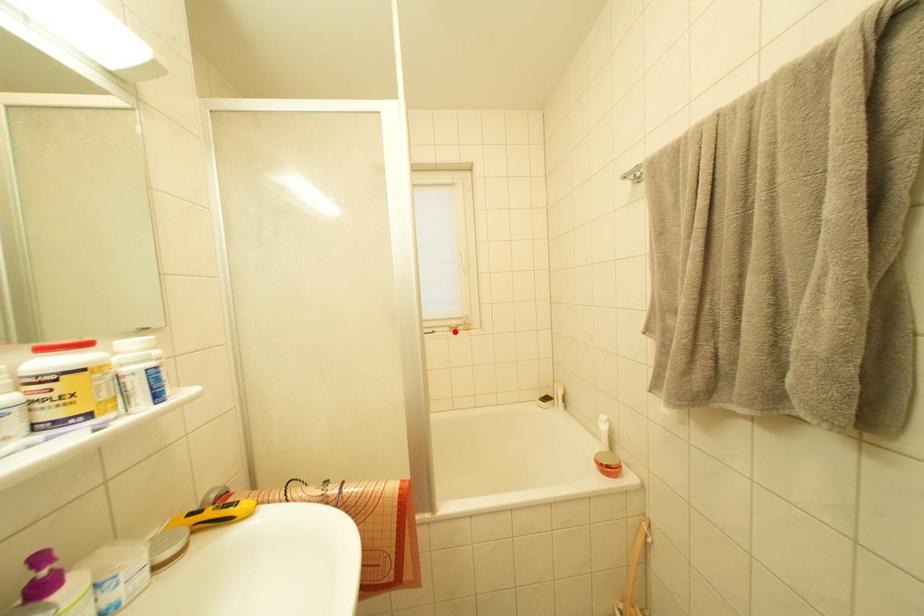
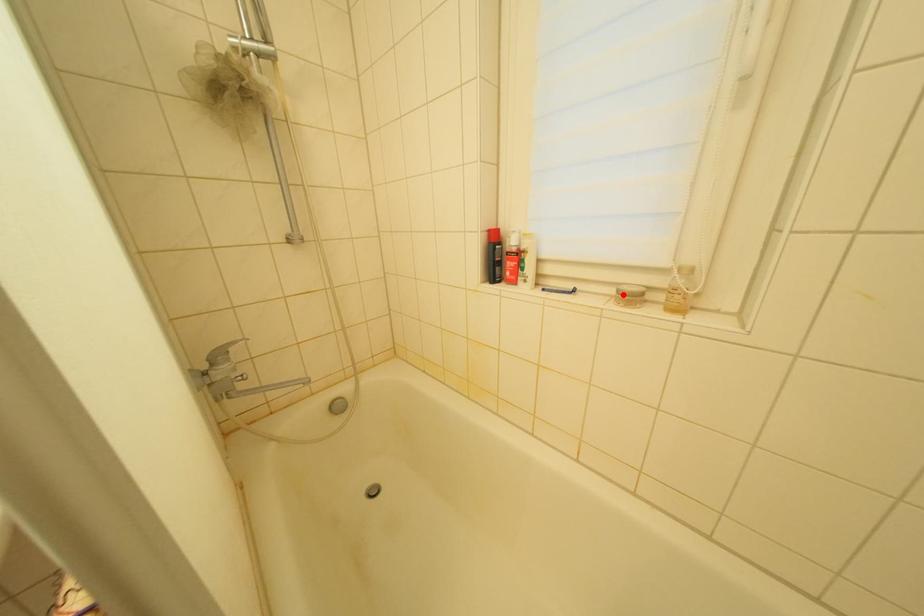
I am providing you with two images of the same scene from different viewpoints. A red point is marked on the first image and another point is marked on the second image. Is the marked point in image1 the same physical position as the marked point in image2?

Yes